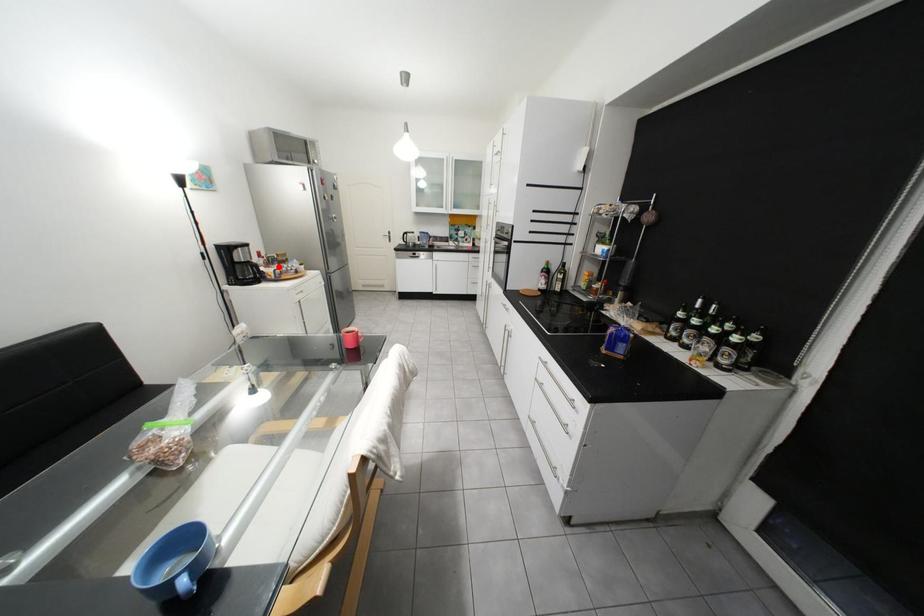
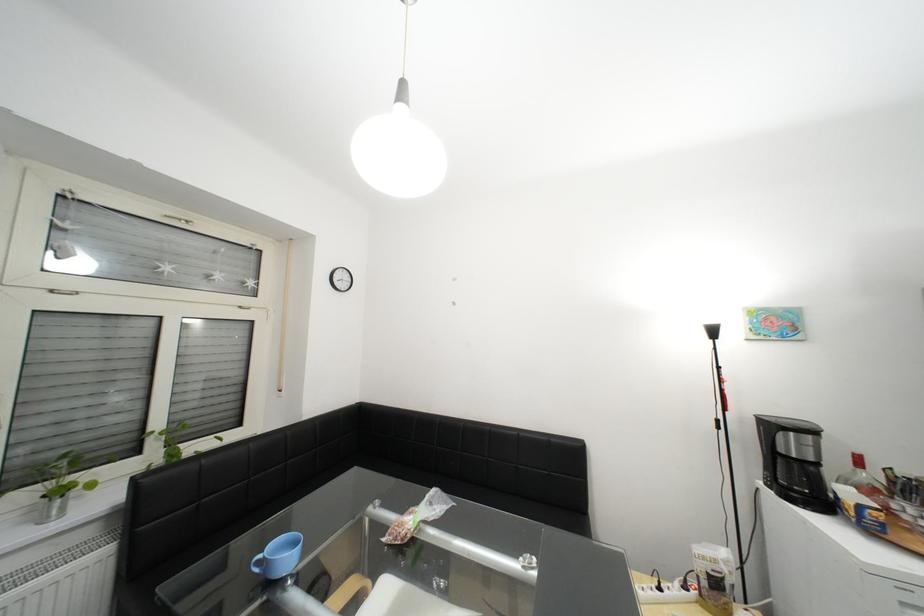
Find the pixel in the second image that matches the highlighted location in the first image.

(881, 492)